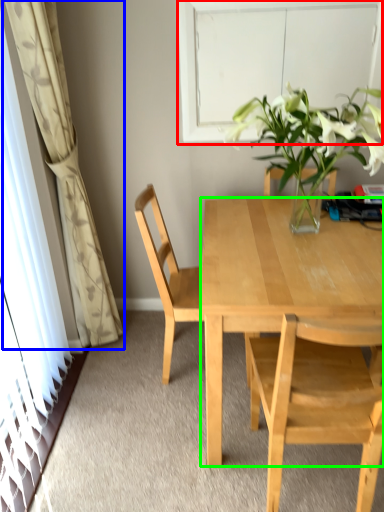
Question: Based on their relative distances, which object is nearer to window (highlighted by a red box)? Choose from curtain (highlighted by a blue box) and desk (highlighted by a green box).

Choices:
 (A) curtain
 (B) desk

Answer: (B)